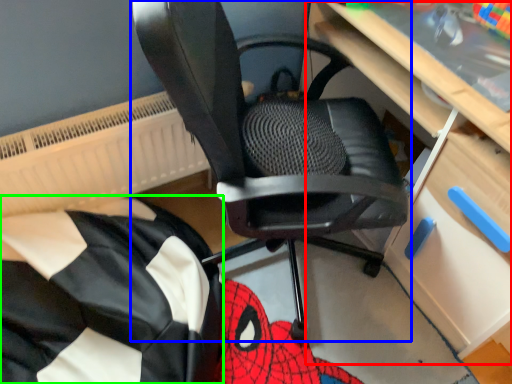
Question: Which object is the closest to the computer desk (highlighted by a red box)? Choose among these: chair (highlighted by a blue box) or bean bag chair (highlighted by a green box).

Choices:
 (A) chair
 (B) bean bag chair

Answer: (A)